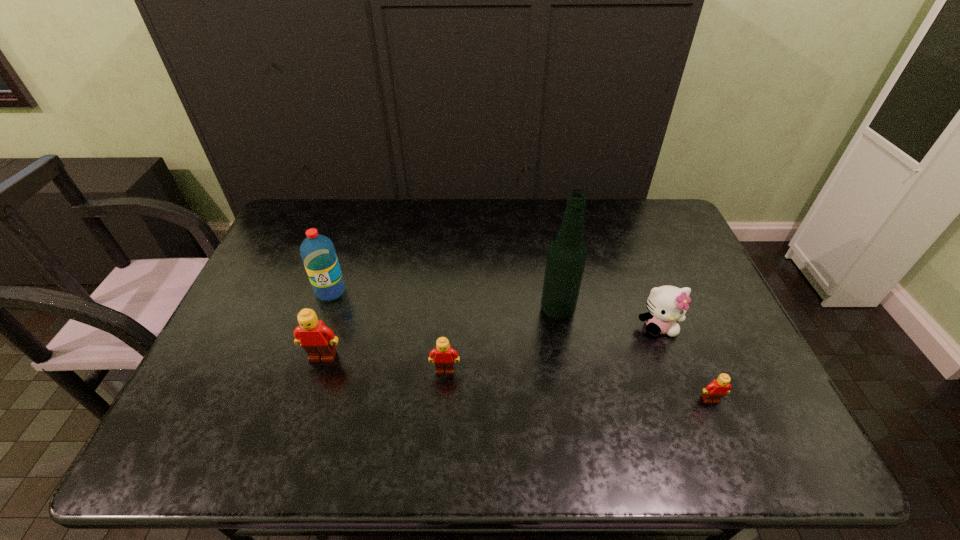
Locate an element on the screen. This screenshot has width=960, height=540. the leftmost Lego is located at coordinates (317, 340).

Find the location of `the tallest Lego`. the tallest Lego is located at coordinates (317, 340).

The image size is (960, 540). Identify the location of the second nearest Lego. [x=445, y=356].

You are a GUI agent. You are given a task and a screenshot of the screen. Output one action in this format:
    pyautogui.click(x=<x>, y=<y>)
    Task: Click on the second tallest Lego
    
    Given the screenshot: What is the action you would take?
    pyautogui.click(x=445, y=356)

The height and width of the screenshot is (540, 960). I want to click on the nearest Lego, so click(x=718, y=388).

Identify the location of the shortest Lego. The height and width of the screenshot is (540, 960). pos(718,388).

Locate an element on the screen. The width and height of the screenshot is (960, 540). the fifth shortest object is located at coordinates (318, 254).

Locate an element on the screen. kitten is located at coordinates [x=666, y=304].

This screenshot has height=540, width=960. I want to click on alcohol, so click(566, 258).

Image resolution: width=960 pixels, height=540 pixels. Find the location of `the tallest object`. the tallest object is located at coordinates (566, 258).